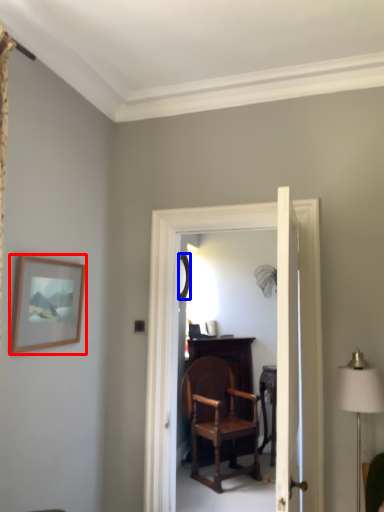
Question: Among these objects, which one is farthest to the camera, picture frame (highlighted by a red box) or mirror (highlighted by a blue box)?

Choices:
 (A) picture frame
 (B) mirror

Answer: (B)